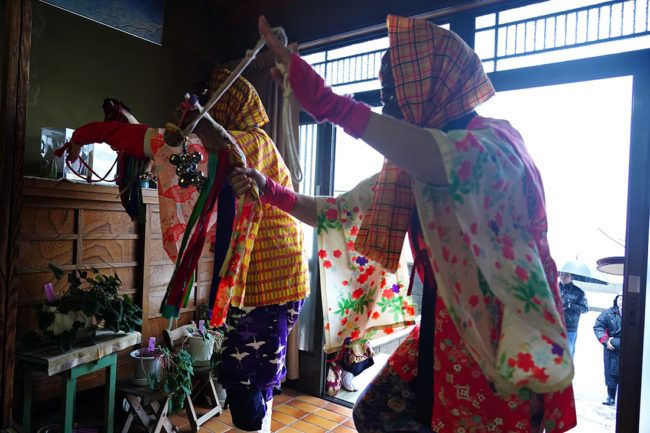
Where is `floor`? floor is located at coordinates (309, 427).